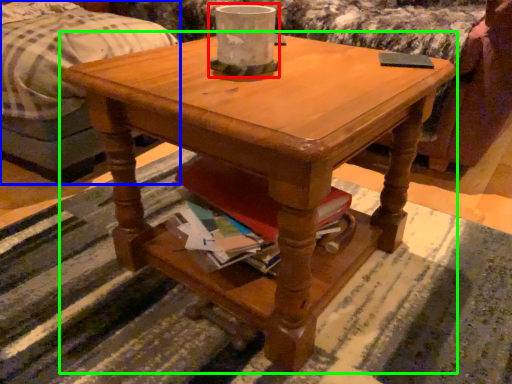
Question: Which object is positioned farthest from candle holder (highlighted by a red box)? Select from bed (highlighted by a blue box) and coffee table (highlighted by a green box).

Choices:
 (A) bed
 (B) coffee table

Answer: (A)